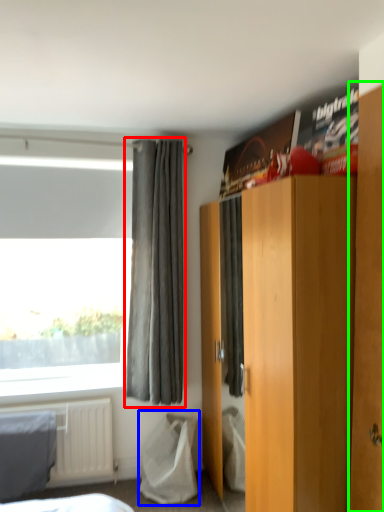
Question: Considering the real-world distances, which object is closest to curtain (highlighted by a red box)? sheet (highlighted by a blue box) or armoire (highlighted by a green box).

Choices:
 (A) sheet
 (B) armoire

Answer: (A)